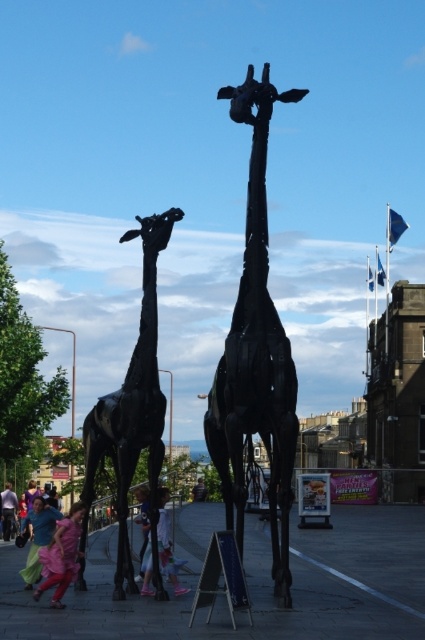
Who is higher up, matte pink dress at lower left or matte blue dress at lower left?

matte pink dress at lower left is above.

Can you confirm if matte pink dress at lower left is taller than matte blue dress at lower left?

Incorrect, matte pink dress at lower left's height is not larger of matte blue dress at lower left's.

Locate an element on the screen. This screenshot has height=640, width=425. matte pink dress at lower left is located at coordinates (62, 556).

Which of these two, black matte giraffe at left or matte blue dress at lower left, stands taller?

With more height is black matte giraffe at left.

Between point (158, 403) and point (34, 564), which one is positioned in front?

Point (158, 403)

Does point (149, 468) come closer to viewer compared to point (45, 522)?

Yes, it is.

This screenshot has height=640, width=425. In order to click on black matte giraffe at left in this screenshot , I will do `click(133, 404)`.

Who is more distant from viewer, (257, 230) or (2, 502)?

The point (2, 502) is more distant.

Is point (260, 250) positioned in front of point (2, 515)?

Yes, it is in front of point (2, 515).

Find the location of a particular element. Image resolution: width=425 pixels, height=640 pixels. black metal giraffe at center is located at coordinates (255, 353).